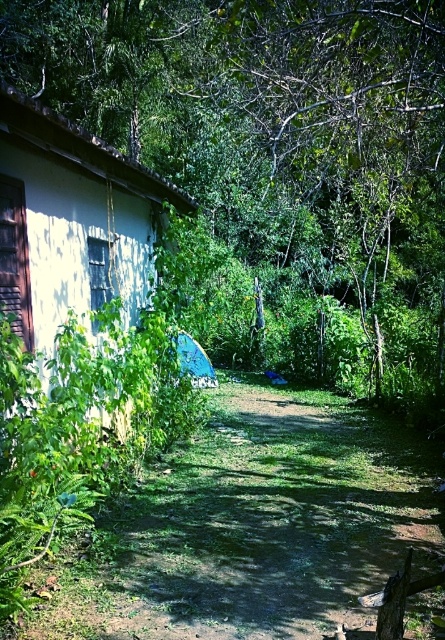
You are planning to walk along the dirt path at center and need to know if it is wider than the white matte hut at left. Can you confirm this?

The dirt path at center is wider than the white matte hut at left according to the description.